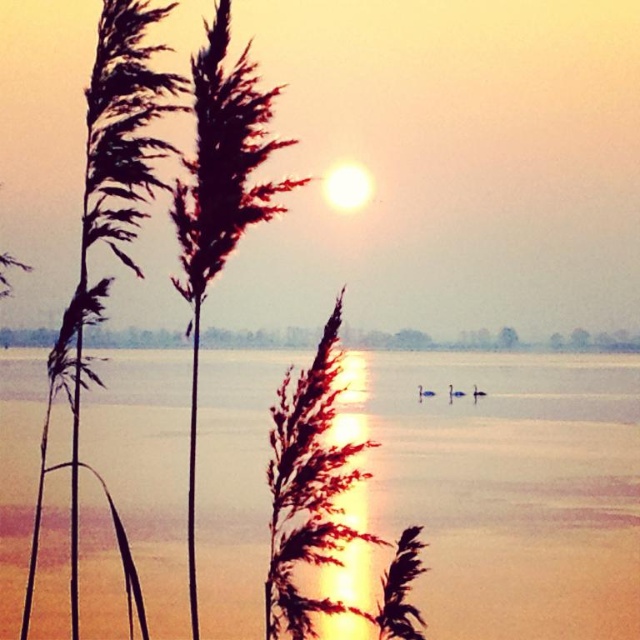
Question: Which object is closer to the camera taking this photo?

Choices:
 (A) smooth water at center
 (B) brown fuzzy reed at left
 (C) silvery reeds at left
 (D) transparent water at center

Answer: (C)

Question: Which object is closer to the camera taking this photo?

Choices:
 (A) brown fuzzy reed at left
 (B) smooth water at center
 (C) transparent water at center

Answer: (A)

Question: In this image, where is transparent water at center located relative to silvery reeds at left?

Choices:
 (A) right
 (B) left

Answer: (A)

Question: Among these objects, which one is nearest to the camera?

Choices:
 (A) transparent water at center
 (B) smooth water at center

Answer: (A)

Question: Is transparent water at center smaller than silvery reeds at left?

Choices:
 (A) yes
 (B) no

Answer: (A)

Question: Is silvery reeds at left below brown fuzzy reed at left?

Choices:
 (A) yes
 (B) no

Answer: (B)